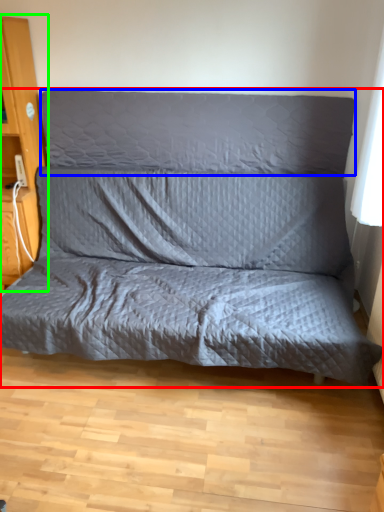
Question: Considering the real-world distances, which object is closest to studio couch (highlighted by a red box)? pillow (highlighted by a blue box) or dresser (highlighted by a green box).

Choices:
 (A) pillow
 (B) dresser

Answer: (A)